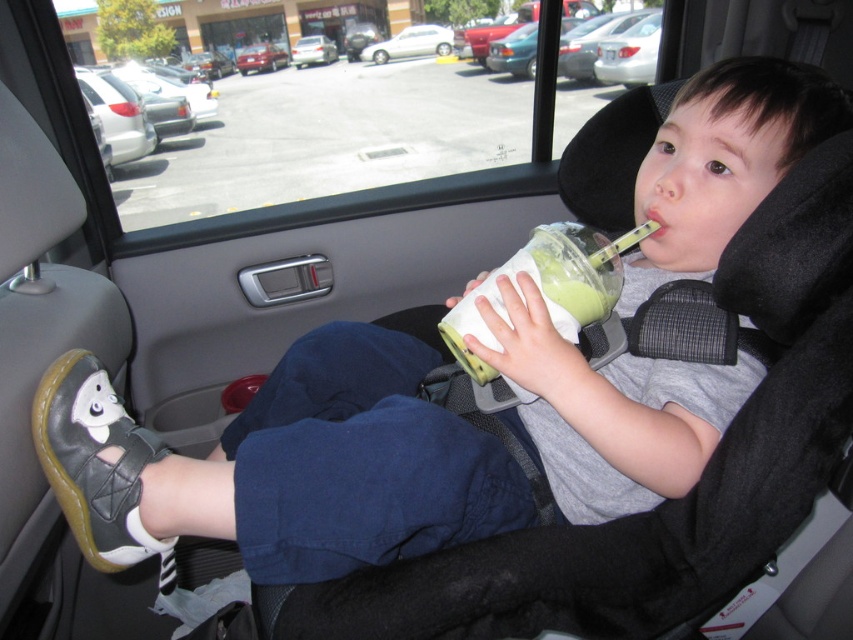
Between white matte car at center and metallic red car at center, which one has less height?

metallic red car at center

Can you confirm if white matte car at center is positioned to the right of metallic red car at center?

Yes, white matte car at center is to the right of metallic red car at center.

Is point (397, 49) closer to camera compared to point (256, 48)?

Yes, it is in front of point (256, 48).

Identify the location of white matte car at center. The width and height of the screenshot is (853, 640). pyautogui.click(x=410, y=44).

How much distance is there between metallic red car at center and white plastic car at center?

metallic red car at center and white plastic car at center are 18.17 inches apart.

The image size is (853, 640). What do you see at coordinates (260, 58) in the screenshot?
I see `metallic red car at center` at bounding box center [260, 58].

Is point (254, 45) closer to camera compared to point (305, 45)?

No, (254, 45) is further to viewer.

At what (x,y) coordinates should I click in order to perform the action: click on metallic red car at center. Please return your answer as a coordinate pair (x, y). This screenshot has width=853, height=640. Looking at the image, I should click on (260, 58).

Consider the image. Which of these two, white matte car at center or white plastic car at center, stands shorter?

Standing shorter between the two is white plastic car at center.

Consider the image. Measure the distance between white matte car at center and white plastic car at center.

white matte car at center is 36.47 inches away from white plastic car at center.

Which is behind, point (434, 52) or point (329, 54)?

Point (329, 54)

Find the location of a particular element. white matte car at center is located at coordinates (410, 44).